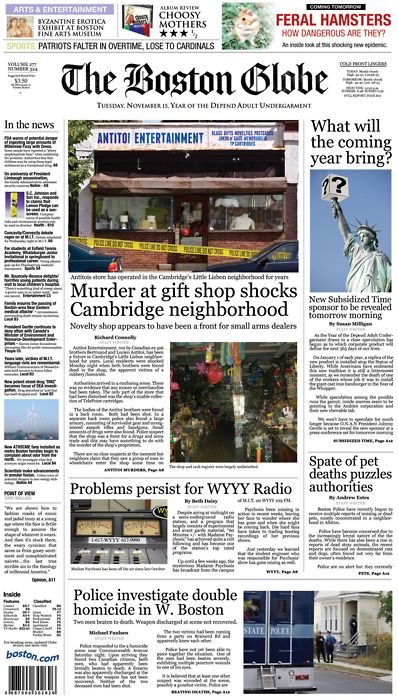
Identify the location of handrail. (350, 637).